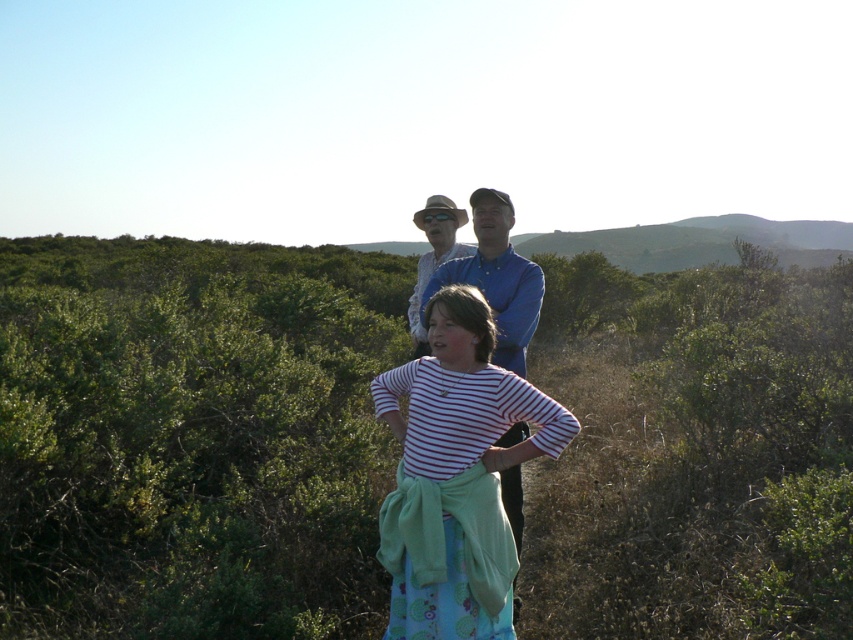
You are a photographer trying to capture a candid shot of the striped cotton shirt at center. There is a point at coordinates (456, 476) that you need to focus on. Based on the scene description, can you confirm if this point is on the striped cotton shirt at center?

Yes, the point at coordinates (456, 476) is on the striped cotton shirt at center, so focusing there would capture the shirt effectively.

Based on the scene description, can you determine which object is larger between the green leafy shrubs at center and the striped cotton shirt at center?

The green leafy shrubs at center are larger than the striped cotton shirt at center according to the description.

You are a photographer setting up a tripod to take a group photo of the blue denim shirt at center and the matte white shirt at center. The minimum distance your camera can focus clearly is 24 inches. Will both subjects be in focus if they stay exactly 24.70 inches apart?

The distance between the blue denim shirt at center and matte white shirt at center is 24.70 inches. Since the minimum focus distance is 24 inches, the 24.70 inches separation is just beyond the threshold. Therefore, the camera might struggle to keep both in focus simultaneously. Advise them to move slightly closer to ensure clarity.